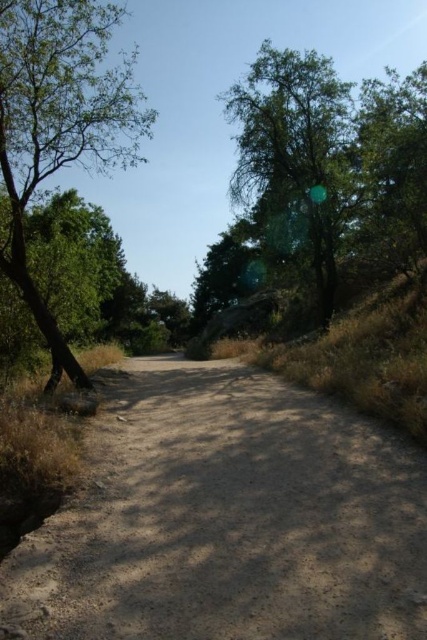
Question: Which object is positioned closest to the dusty brown dirt track at center?

Choices:
 (A) green leafy tree at left
 (B) green leafy tree at upper right

Answer: (B)

Question: Among these objects, which one is nearest to the camera?

Choices:
 (A) dusty brown dirt track at center
 (B) green leafy tree at upper right
 (C) green leafy tree at left

Answer: (A)

Question: Does green leafy tree at upper right appear under green leafy tree at left?

Choices:
 (A) no
 (B) yes

Answer: (B)

Question: From the image, what is the correct spatial relationship of green leafy tree at upper right in relation to green leafy tree at left?

Choices:
 (A) left
 (B) right

Answer: (B)

Question: Among these points, which one is nearest to the camera?

Choices:
 (A) (116, 10)
 (B) (412, 96)
 (C) (409, 529)

Answer: (C)

Question: From the image, what is the correct spatial relationship of green leafy tree at upper right in relation to green leafy tree at left?

Choices:
 (A) below
 (B) above

Answer: (A)